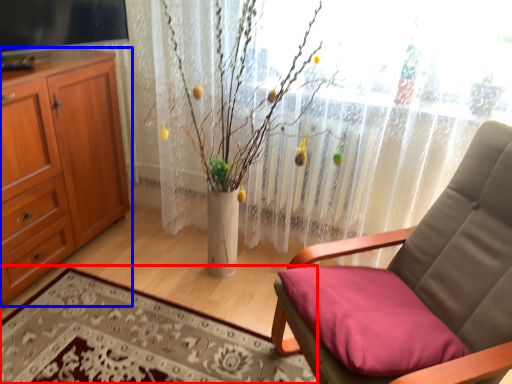
Question: Which of the following is the closest to the observer, plain (highlighted by a red box) or cabinetry (highlighted by a blue box)?

Choices:
 (A) plain
 (B) cabinetry

Answer: (A)